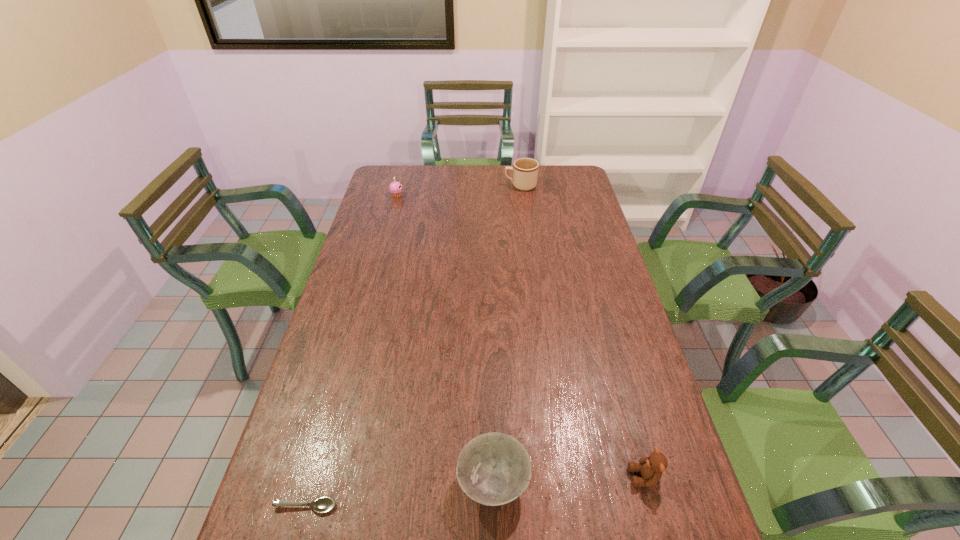
This screenshot has width=960, height=540. Identify the location of vacant space located on the face of the rightmost object. (470, 477).

Locate an element on the screen. vacant space positioned on the face of the cupcake is located at coordinates (424, 195).

Image resolution: width=960 pixels, height=540 pixels. I want to click on vacant area situated on the right of the bowl, so click(600, 483).

The width and height of the screenshot is (960, 540). In order to click on vacant space located on the right of the soupspoon in this screenshot , I will do `click(373, 507)`.

Locate an element on the screen. object present at the far edge is located at coordinates (525, 170).

Locate an element on the screen. This screenshot has width=960, height=540. cupcake at the left edge is located at coordinates (395, 188).

Locate an element on the screen. The width and height of the screenshot is (960, 540). soupspoon that is at the left edge is located at coordinates (322, 505).

Locate an element on the screen. This screenshot has height=540, width=960. object that is at the right edge is located at coordinates (651, 468).

The image size is (960, 540). In the image, there is a desktop. Identify the location of free space at the far edge. (513, 165).

The image size is (960, 540). In order to click on free space at the left edge in this screenshot , I will do `click(371, 218)`.